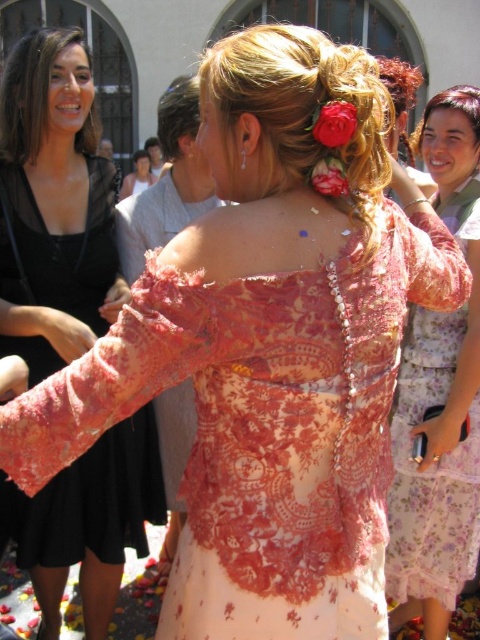
Between matte lace dress at upper left and blonde lace braid at upper center, which one appears on the left side from the viewer's perspective?

matte lace dress at upper left

Between matte lace dress at upper left and blonde lace braid at upper center, which one has less height?

blonde lace braid at upper center is shorter.

At what (x,y) coordinates should I click in order to perform the action: click on matte lace dress at upper left. Please return your answer as a coordinate pair (x, y). The image size is (480, 640). Looking at the image, I should click on (54, 205).

The width and height of the screenshot is (480, 640). Describe the element at coordinates (300, 115) in the screenshot. I see `blonde lace braid at upper center` at that location.

Can you confirm if blonde lace braid at upper center is smaller than dark brown hair at upper center?

Yes.

The height and width of the screenshot is (640, 480). In order to click on blonde lace braid at upper center in this screenshot , I will do `click(300, 115)`.

Is floral lace dress at center bigger than silky red flower at upper center?

Yes.

Is floral lace dress at center to the right of silky red flower at upper center from the viewer's perspective?

Correct, you'll find floral lace dress at center to the right of silky red flower at upper center.

The image size is (480, 640). What do you see at coordinates (440, 396) in the screenshot? I see `floral lace dress at center` at bounding box center [440, 396].

Find the location of a particular element. This screenshot has width=480, height=640. floral lace dress at center is located at coordinates (440, 396).